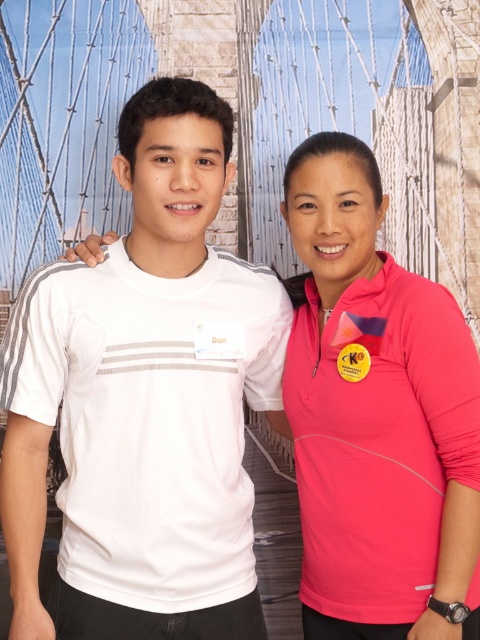
Between white matte t-shirt at center and matte white suspension bridge at center, which one appears on the right side from the viewer's perspective?

From the viewer's perspective, matte white suspension bridge at center appears more on the right side.

Between white matte t-shirt at center and matte white suspension bridge at center, which one is positioned higher?

matte white suspension bridge at center

Measure the distance between white matte t-shirt at center and camera.

The distance of white matte t-shirt at center from camera is 31.91 meters.

In order to click on white matte t-shirt at center in this screenshot , I will do `click(144, 401)`.

Who is shorter, matte white suspension bridge at center or pink matte/polyester shirt at right?

matte white suspension bridge at center is shorter.

Locate an element on the screen. The height and width of the screenshot is (640, 480). matte white suspension bridge at center is located at coordinates pos(247,116).

Is point (141, 512) more distant than point (313, 588)?

That is False.

Does white matte t-shirt at center have a smaller size compared to pink matte/polyester shirt at right?

Incorrect, white matte t-shirt at center is not smaller in size than pink matte/polyester shirt at right.

Which is in front, point (82, 589) or point (300, 163)?

Point (82, 589)

Where is `white matte t-shirt at center`? The height and width of the screenshot is (640, 480). white matte t-shirt at center is located at coordinates point(144,401).